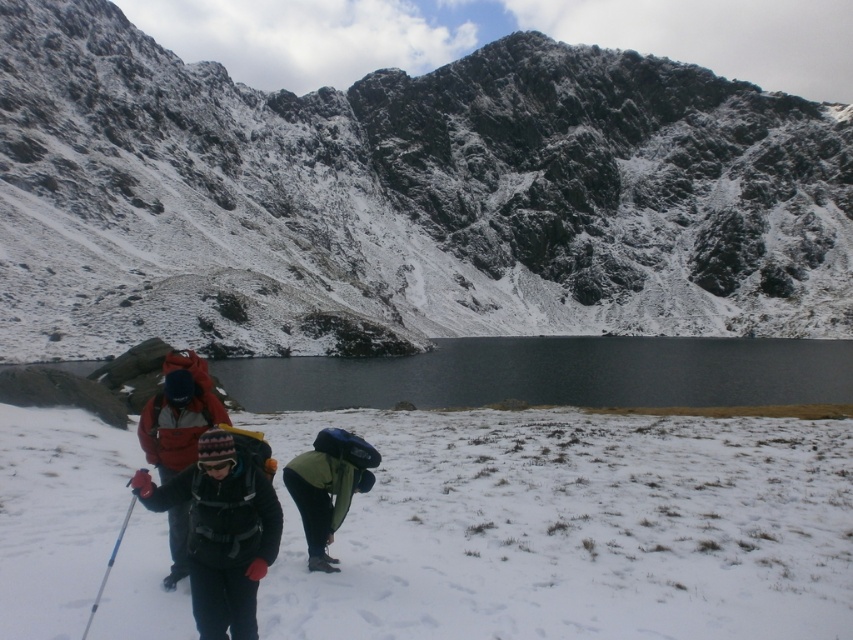
Question: Which point is farther to the camera?

Choices:
 (A) (175, 541)
 (B) (114, 632)

Answer: (A)

Question: Is snowy rocky mountain at center wider than smooth dark water at center?

Choices:
 (A) no
 (B) yes

Answer: (B)

Question: Which point appears closest to the camera in this image?

Choices:
 (A) (212, 449)
 (B) (338, 486)
 (C) (442, 193)
 (D) (109, 563)

Answer: (A)

Question: Can you confirm if white fluffy snow at lower center is positioned above matte black backpack at center?

Choices:
 (A) no
 (B) yes

Answer: (A)

Question: Among these points, which one is farthest from the camera?

Choices:
 (A) (229, 506)
 (B) (338, 481)

Answer: (B)

Question: Considering the relative positions of smooth dark water at center and blue plastic ski pole at lower left in the image provided, where is smooth dark water at center located with respect to blue plastic ski pole at lower left?

Choices:
 (A) left
 (B) right

Answer: (B)